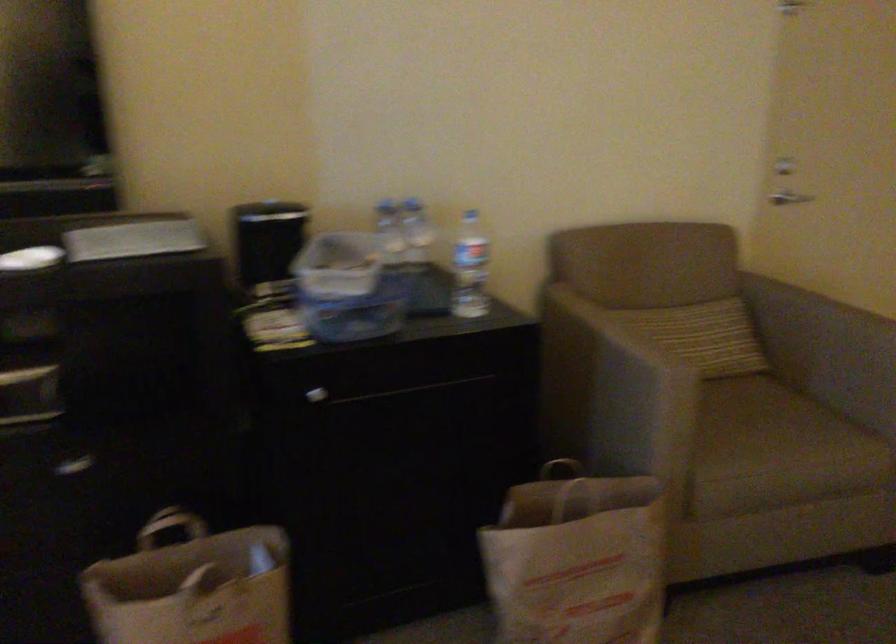
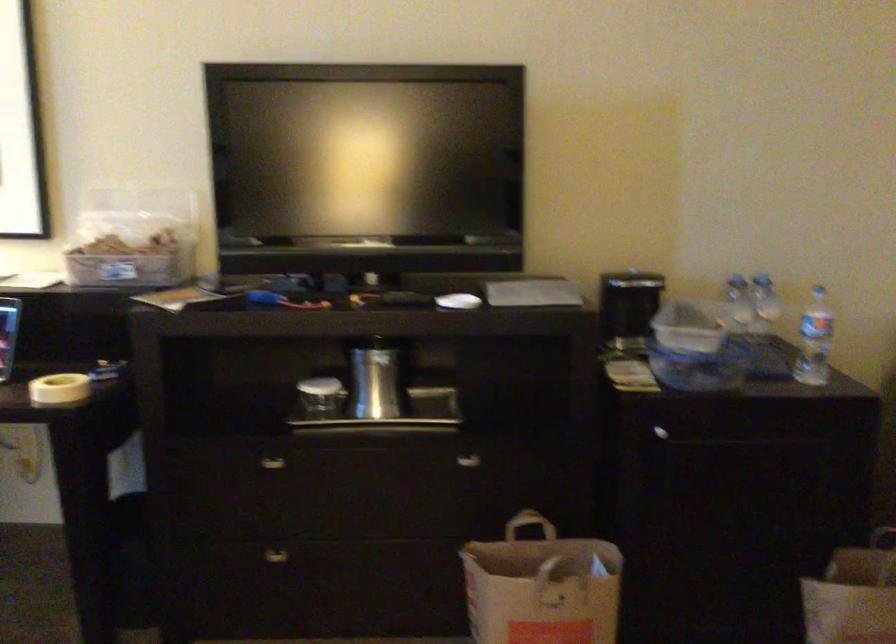
Question: The camera is either moving clockwise (left) or counter-clockwise (right) around the object. The first image is from the beginning of the video and the second image is from the end. Is the camera moving left or right when shooting the video?

Choices:
 (A) Left
 (B) Right

Answer: (B)